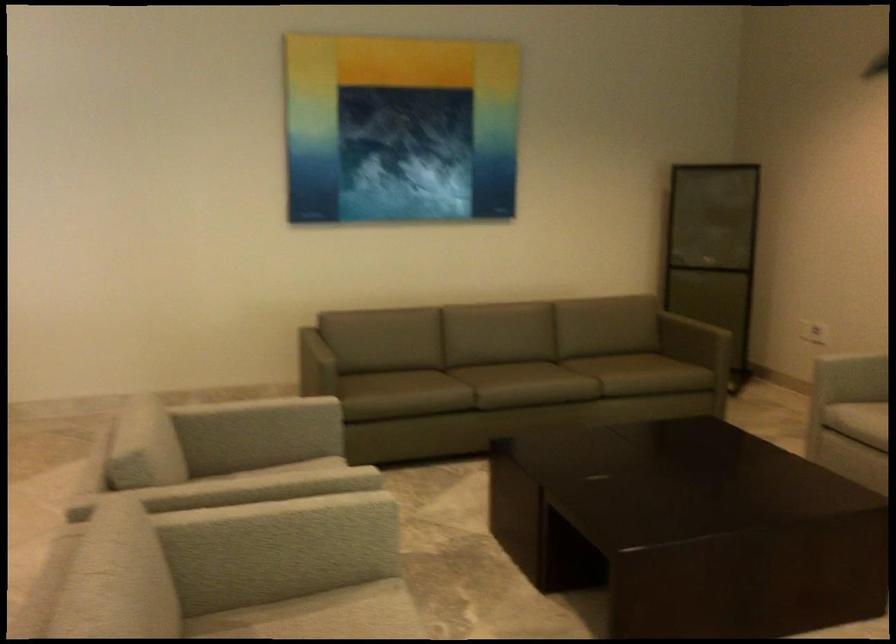
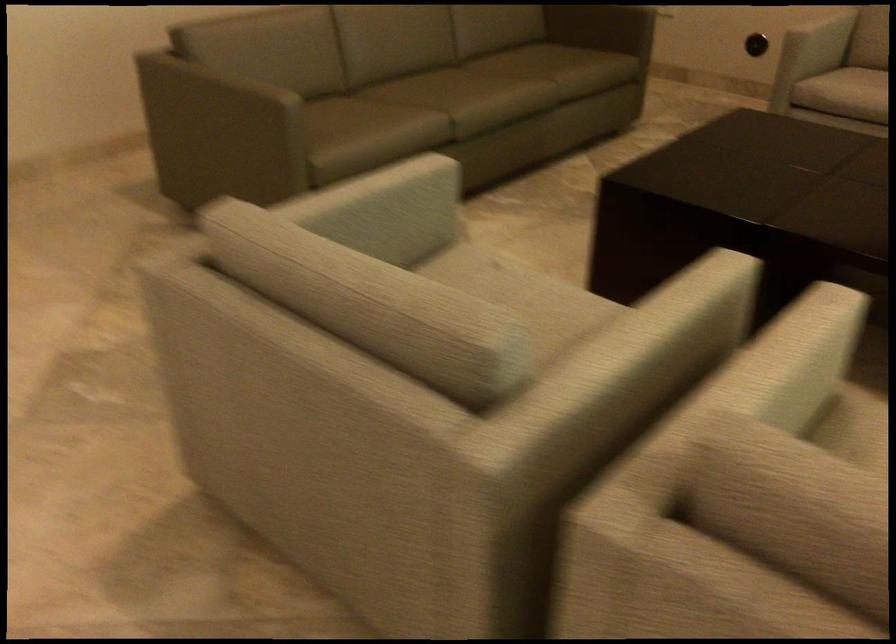
Where in the second image is the point corresponding to pixel 97 526 from the first image?

(806, 468)